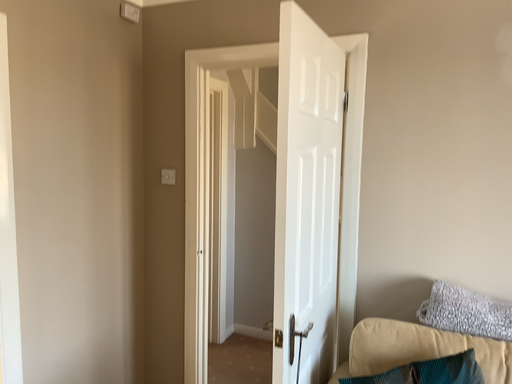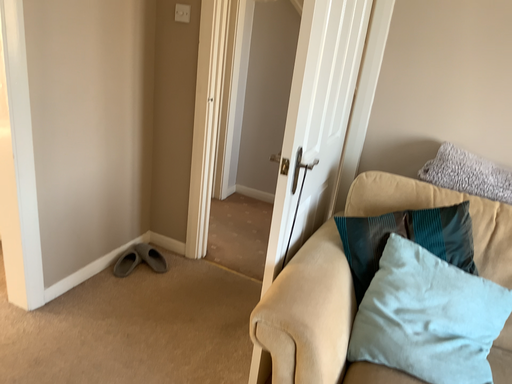
Question: How did the camera likely rotate when shooting the video?

Choices:
 (A) rotated upward
 (B) rotated downward

Answer: (B)